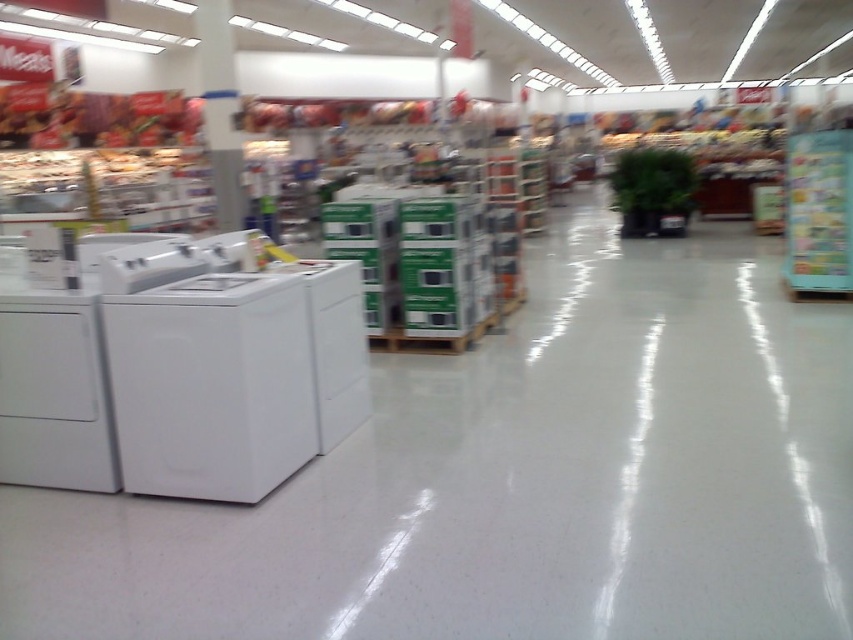
Is white glossy washer at left positioned at the back of white glossy washer at center?

No, it is in front of white glossy washer at center.

Can you confirm if white glossy washer at left is thinner than white glossy washer at center?

No.

Identify the location of white glossy washer at left. (206, 372).

The image size is (853, 640). I want to click on white glossy washer at left, so click(x=206, y=372).